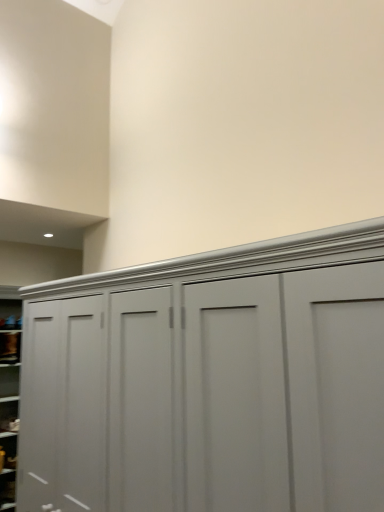
Question: From the image's perspective, relative to matte gray cupboard at center, is matte gray cabinet at lower left, the second cabinet when ordered from top to bottom, above or below?

Choices:
 (A) above
 (B) below

Answer: (B)

Question: Does point (11, 477) appear closer or farther from the camera than point (110, 364)?

Choices:
 (A) closer
 (B) farther

Answer: (B)

Question: Considering the real-world distances, which object is closest to the matte gray cabinet at lower left, the second cabinet when ordered from top to bottom?

Choices:
 (A) matte gray cupboard at center
 (B) matte gray cabinet at lower left, the first cabinet when ordered from top to bottom

Answer: (B)

Question: Based on their relative distances, which object is nearer to the matte gray cabinet at lower left, the second cabinet when ordered from top to bottom?

Choices:
 (A) matte gray cabinet at lower left, placed as the 2th cabinet when sorted from bottom to top
 (B) matte gray cupboard at center

Answer: (A)